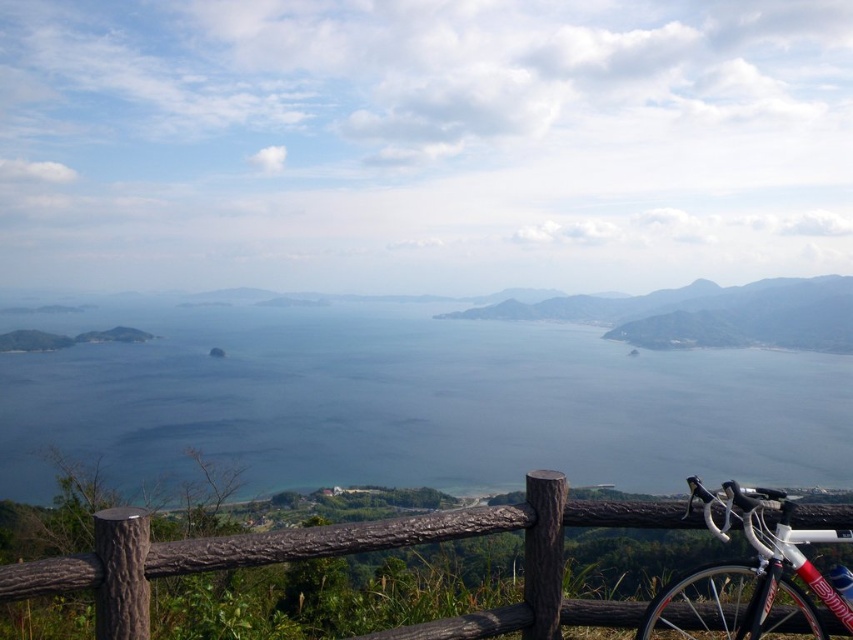
Who is more forward, (456, 438) or (759, 544)?

Point (759, 544)

Between blue water at center and white metallic mountain bike at lower right, which one appears on the left side from the viewer's perspective?

Answer: From the viewer's perspective, white metallic mountain bike at lower right appears more on the left side.

You are a GUI agent. You are given a task and a screenshot of the screen. Output one action in this format:
    pyautogui.click(x=<x>, y=<y>)
    Task: Click on the blue water at center
    
    Given the screenshot: What is the action you would take?
    pyautogui.click(x=416, y=404)

From the picture: Can you confirm if blue water at center is positioned below brown wooden fence at lower center?

Yes, blue water at center is below brown wooden fence at lower center.

Can you confirm if blue water at center is taller than brown wooden fence at lower center?

Correct, blue water at center is much taller as brown wooden fence at lower center.

Who is more distant from viewer, (39, 372) or (560, 492)?

The point (39, 372) is behind.

You are a GUI agent. You are given a task and a screenshot of the screen. Output one action in this format:
    pyautogui.click(x=<x>, y=<y>)
    Task: Click on the blue water at center
    
    Given the screenshot: What is the action you would take?
    pyautogui.click(x=416, y=404)

Who is taller, brown wooden fence at lower center or white metallic mountain bike at lower right?

Standing taller between the two is white metallic mountain bike at lower right.

Between point (173, 563) and point (782, 518), which one is positioned behind?

The point (782, 518) is behind.

Identify the location of brown wooden fence at lower center. This screenshot has width=853, height=640. (352, 552).

Image resolution: width=853 pixels, height=640 pixels. Identify the location of brown wooden fence at lower center. (352, 552).